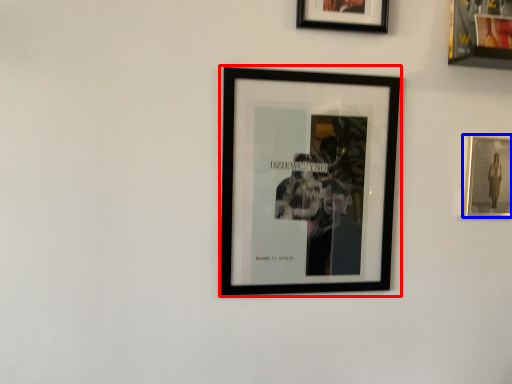
Question: Which of the following is the farthest to the observer, picture frame (highlighted by a red box) or picture frame (highlighted by a blue box)?

Choices:
 (A) picture frame
 (B) picture frame

Answer: (B)